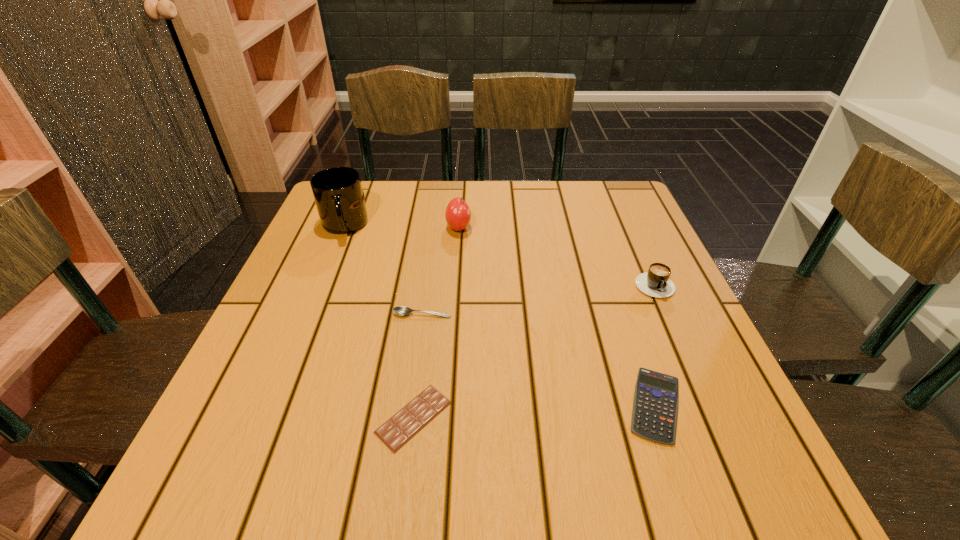
Locate an element on the screen. The width and height of the screenshot is (960, 540). vacant area that lies between the apple and the chocolate bar is located at coordinates (436, 322).

You are a GUI agent. You are given a task and a screenshot of the screen. Output one action in this format:
    pyautogui.click(x=<x>, y=<y>)
    Task: Click on the second closest object to the cappuccino
    
    Given the screenshot: What is the action you would take?
    pyautogui.click(x=458, y=215)

This screenshot has height=540, width=960. Find the location of `object that is the fourth nearest to the chocolate bar`. object that is the fourth nearest to the chocolate bar is located at coordinates (458, 215).

Identify the location of vacant region that satisfies the following two spatial constraints: 1. with the handle on the side of the third nearest object; 2. on the right side of the tallest object. (308, 314).

Locate an element on the screen. free location that satisfies the following two spatial constraints: 1. with the handle on the side of the tallest object; 2. on the left side of the apple is located at coordinates (344, 227).